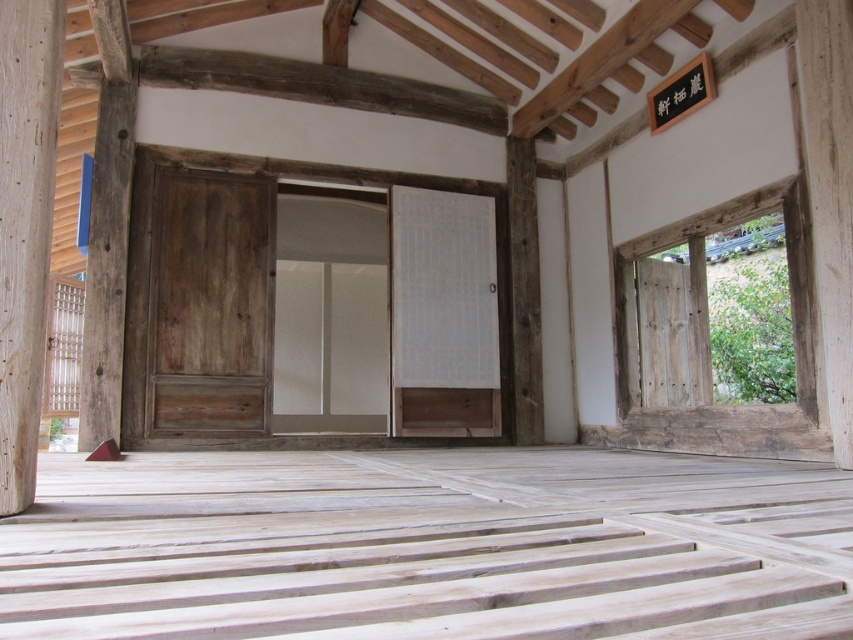
Question: Is natural wood pillar at left bigger than wooden post at center?

Choices:
 (A) yes
 (B) no

Answer: (B)

Question: Which point appears farthest from the camera in this image?

Choices:
 (A) (520, 336)
 (B) (54, 113)

Answer: (A)

Question: Can you confirm if natural wood pillar at left is bigger than wooden post at center?

Choices:
 (A) no
 (B) yes

Answer: (A)

Question: Does natural wood pillar at left have a greater width compared to wooden post at center?

Choices:
 (A) yes
 (B) no

Answer: (B)

Question: Which point is farther to the camera?

Choices:
 (A) click(x=529, y=339)
 (B) click(x=33, y=292)

Answer: (A)